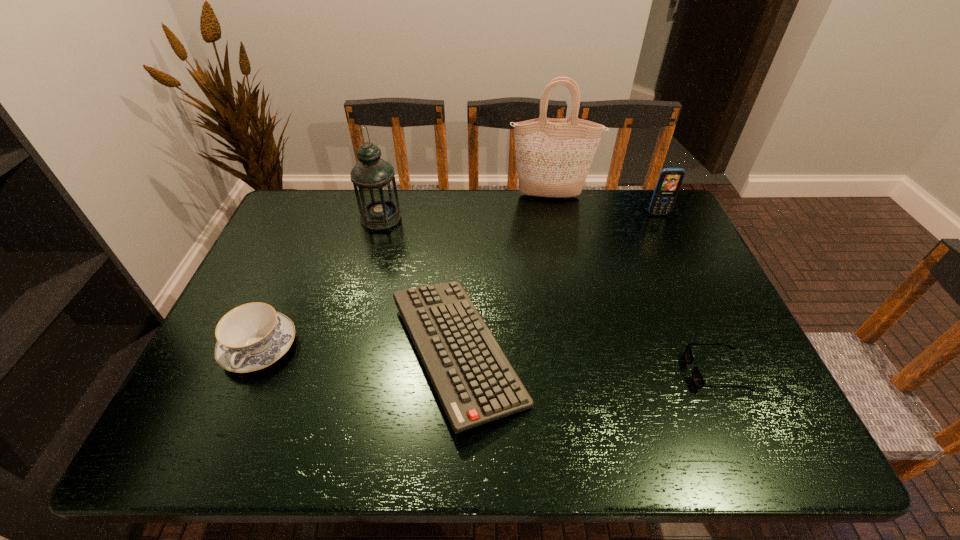
Where is `object that is at the near edge`? This screenshot has height=540, width=960. object that is at the near edge is located at coordinates (476, 384).

Where is `object located at the left edge`? object located at the left edge is located at coordinates (250, 337).

This screenshot has width=960, height=540. What are the coordinates of `cellular telephone at the right edge` in the screenshot? It's located at (669, 181).

Locate an element on the screen. Image resolution: width=960 pixels, height=540 pixels. spectacles that is at the right edge is located at coordinates (697, 378).

This screenshot has height=540, width=960. What are the coordinates of `object that is at the far right corner` in the screenshot? It's located at (669, 181).

In the image, there is a desktop. Identify the location of free space at the far edge. The height and width of the screenshot is (540, 960). (484, 190).

You are a GUI agent. You are given a task and a screenshot of the screen. Output one action in this format:
    pyautogui.click(x=<x>, y=<y>)
    Task: Click on the free space at the near edge of the desktop
    
    Given the screenshot: What is the action you would take?
    pyautogui.click(x=613, y=436)

You are a GUI agent. You are given a task and a screenshot of the screen. Output one action in this format:
    pyautogui.click(x=<x>, y=<y>)
    Task: Click on the free space at the left edge
    This screenshot has height=540, width=960.
    Given the screenshot: What is the action you would take?
    pyautogui.click(x=191, y=387)

Find the location of a particular element. Image resolution: width=960 pixels, height=540 pixels. blank area at the right edge is located at coordinates (713, 364).

Locate an element on the screen. Image resolution: width=960 pixels, height=540 pixels. vacant space at the far left corner of the desktop is located at coordinates (325, 208).